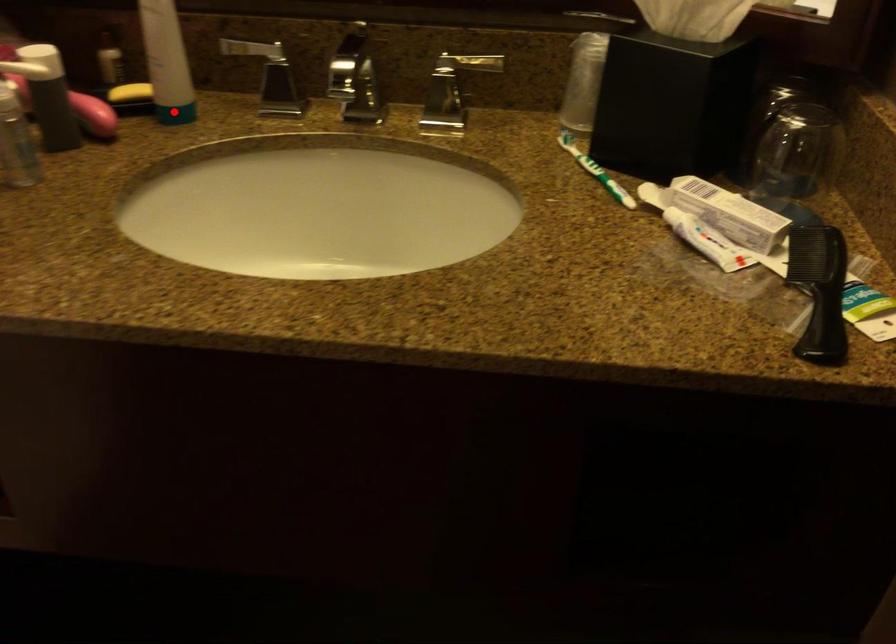
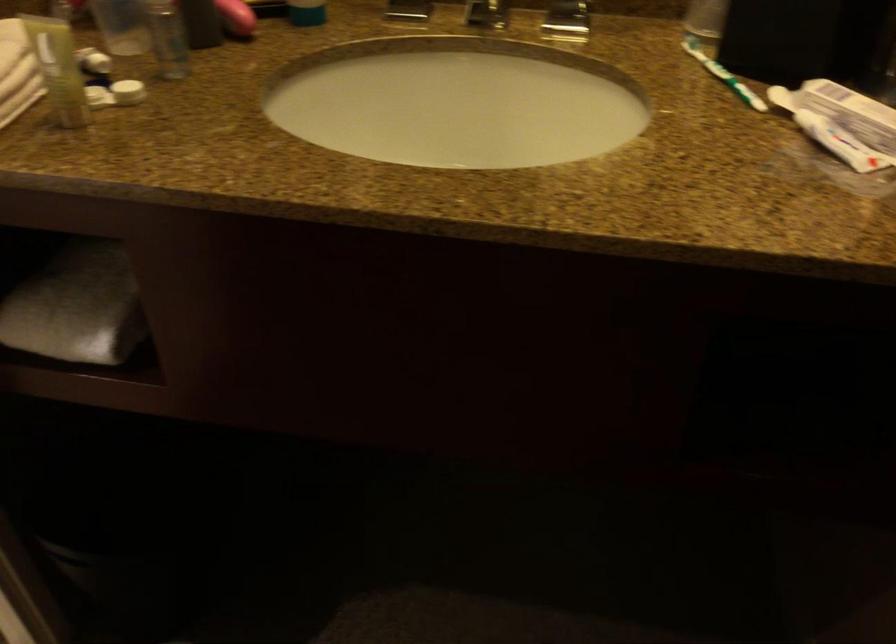
Where in the second image is the point corresponding to the highlighted location from the first image?

(306, 13)